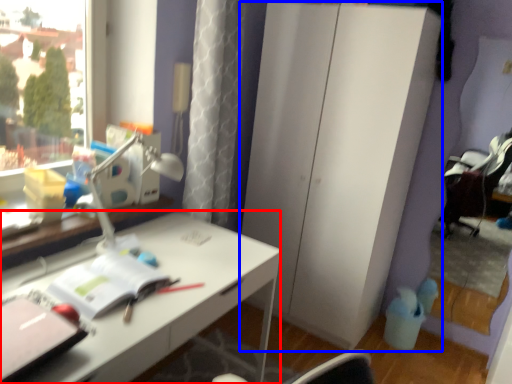
Question: Among these objects, which one is nearest to the camera, desk (highlighted by a red box) or dresser (highlighted by a blue box)?

Choices:
 (A) desk
 (B) dresser

Answer: (A)